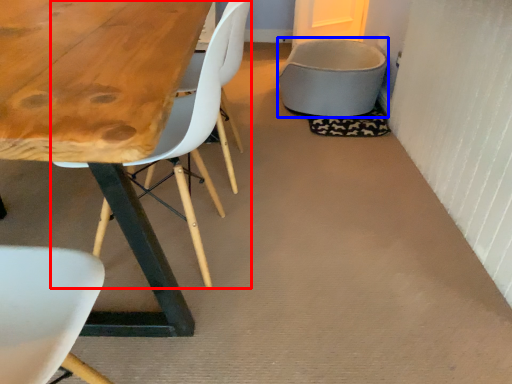
Question: Which object is further to the camera taking this photo, chair (highlighted by a red box) or gray (highlighted by a blue box)?

Choices:
 (A) chair
 (B) gray

Answer: (B)